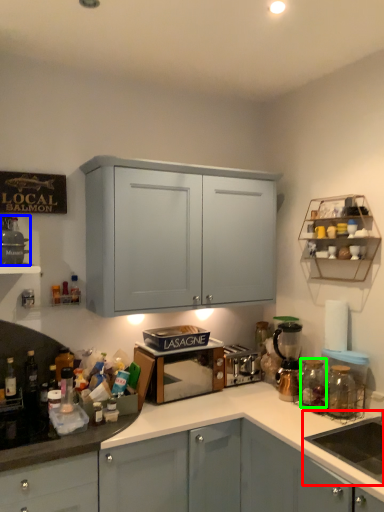
Question: Which object is positioned closest to sink (highlighted by a red box)? Select from appliance (highlighted by a blue box) and glass jar (highlighted by a green box).

Choices:
 (A) appliance
 (B) glass jar

Answer: (B)